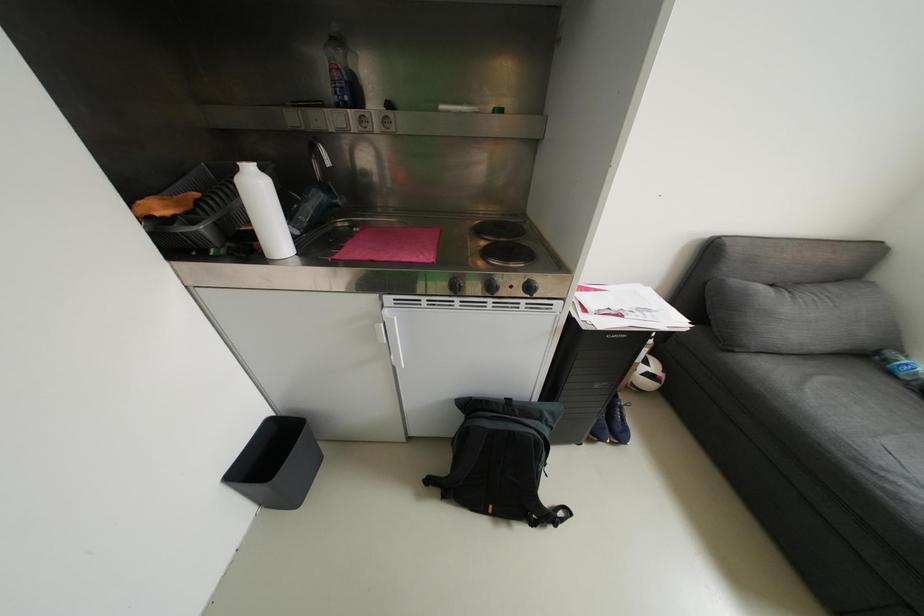
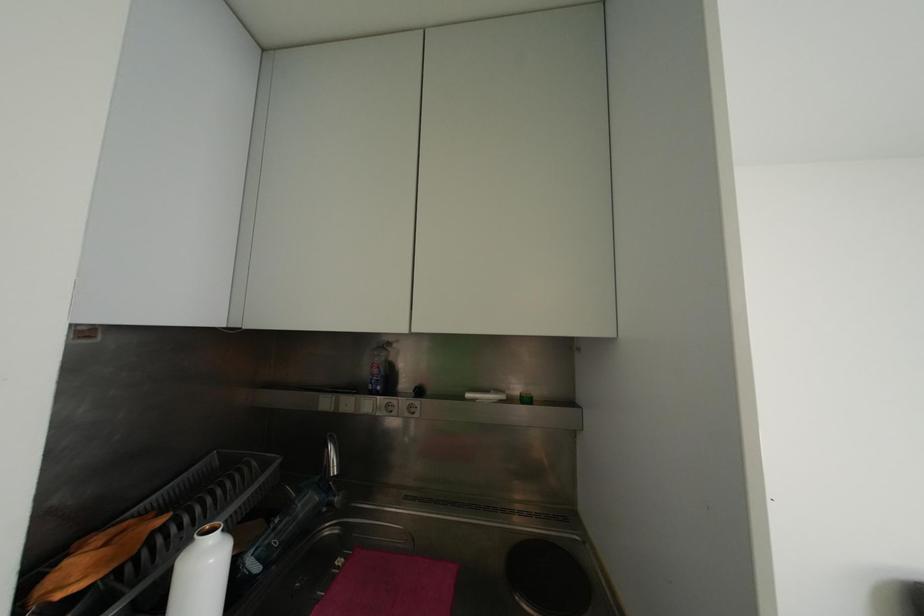
Question: How did the camera likely rotate?

Choices:
 (A) Left
 (B) Right
 (C) Up
 (D) Down

Answer: (C)